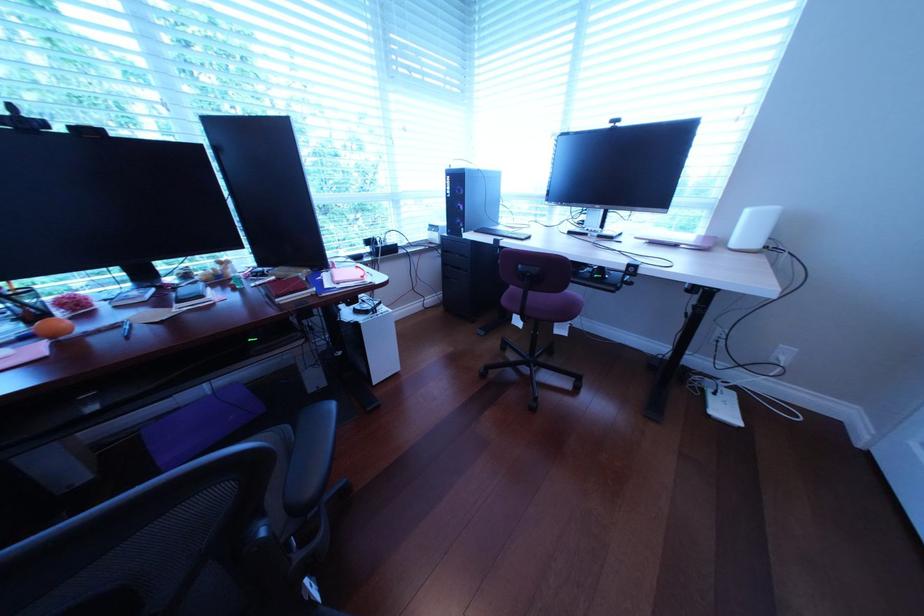
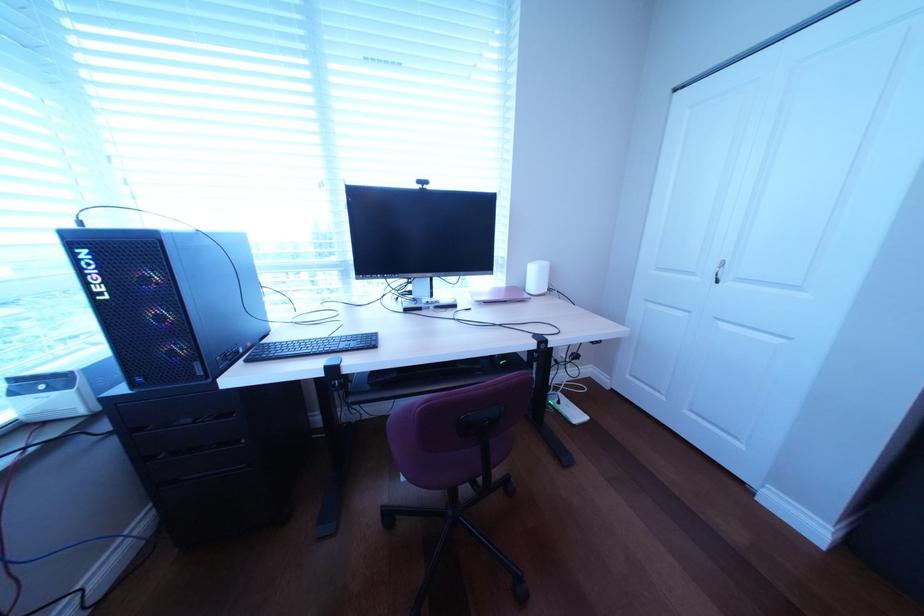
Question: Based on the continuous images, in which direction is the camera rotating? Reply with the corresponding letter.

Choices:
 (A) Left
 (B) Right
 (C) Up
 (D) Down

Answer: (B)